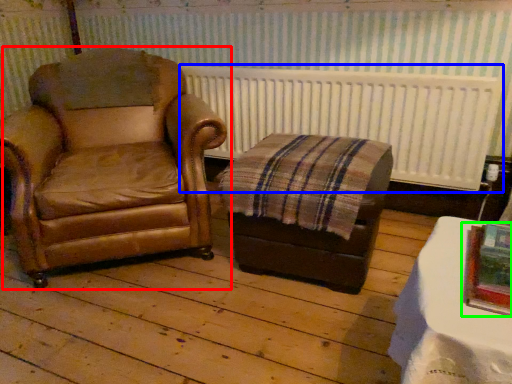
Question: Which object is the farthest from chair (highlighted by a red box)? Choose among these: radiator (highlighted by a blue box) or picture frame (highlighted by a green box).

Choices:
 (A) radiator
 (B) picture frame

Answer: (B)